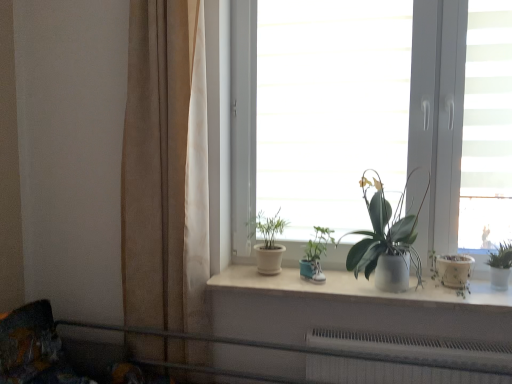
Locate an element on the screen. vacant space that is to the left of teal fabric shoe at center, which is the 2th houseplant from left to right is located at coordinates (271, 281).